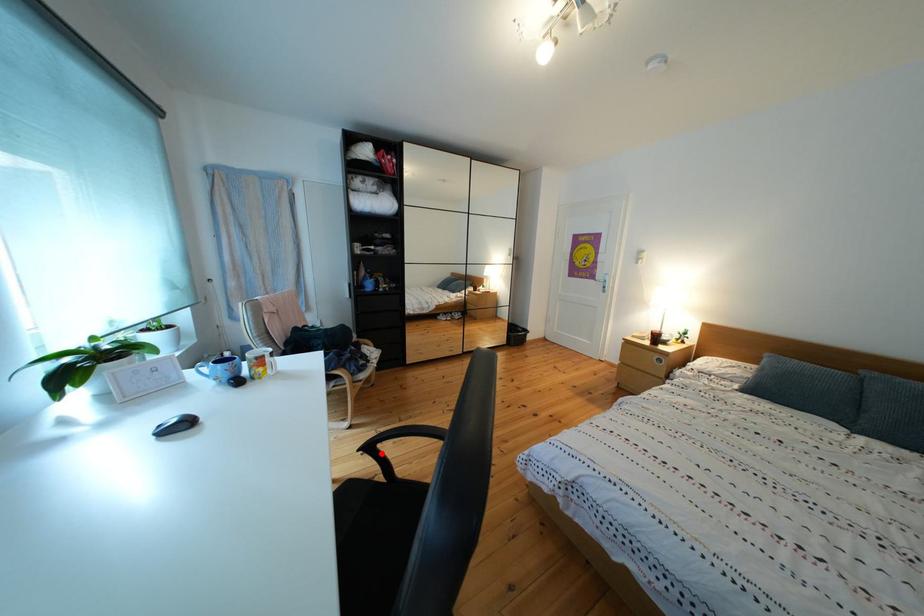
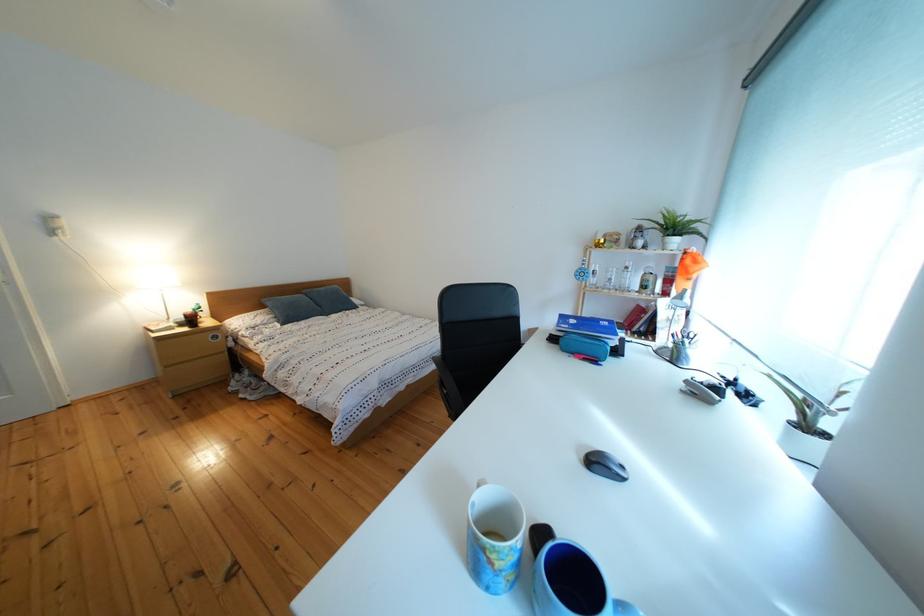
Question: I am providing you with two images of the same scene from different viewpoints. A red point is marked on the first image. At the location where the point appears in image 1, is it still visible in image 2?

Choices:
 (A) Yes
 (B) No

Answer: (B)